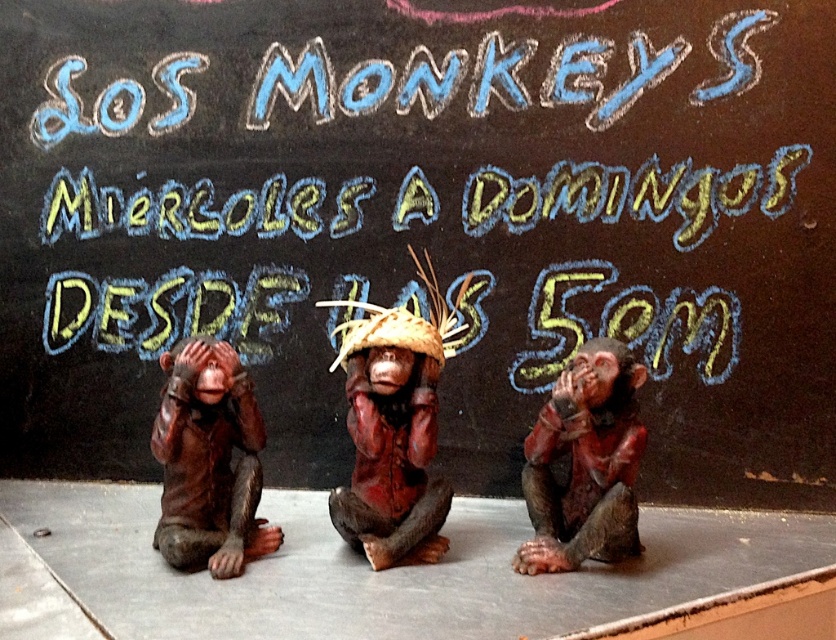
Question: Can you confirm if matte brown statue at left is bigger than matte brown monkey at center?

Choices:
 (A) no
 (B) yes

Answer: (B)

Question: Does matte brown statue at center come behind matte brown monkey at center?

Choices:
 (A) yes
 (B) no

Answer: (A)

Question: Estimate the real-world distances between objects in this image. Which object is closer to the matte brown monkey at center?

Choices:
 (A) matte brown statue at left
 (B) matte brown statue at center

Answer: (B)

Question: Considering the relative positions of matte brown statue at center and matte brown statue at left in the image provided, where is matte brown statue at center located with respect to matte brown statue at left?

Choices:
 (A) above
 (B) below

Answer: (A)

Question: Which object is the farthest from the matte brown statue at center?

Choices:
 (A) matte brown monkey at center
 (B) matte brown statue at left

Answer: (A)

Question: Which object is closer to the camera taking this photo?

Choices:
 (A) matte brown statue at left
 (B) matte brown monkey at center
 (C) matte brown statue at center

Answer: (B)